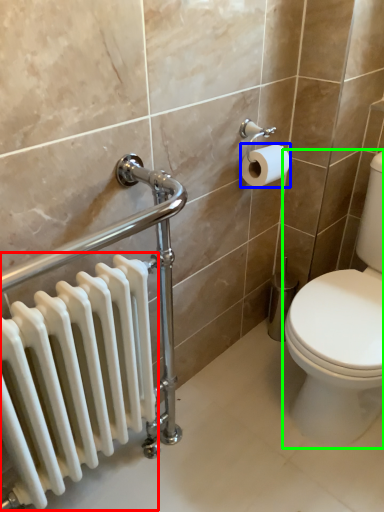
Question: Which object is positioned closest to radiator (highlighted by a red box)? Select from toilet paper (highlighted by a blue box) and toilet (highlighted by a green box).

Choices:
 (A) toilet paper
 (B) toilet

Answer: (B)